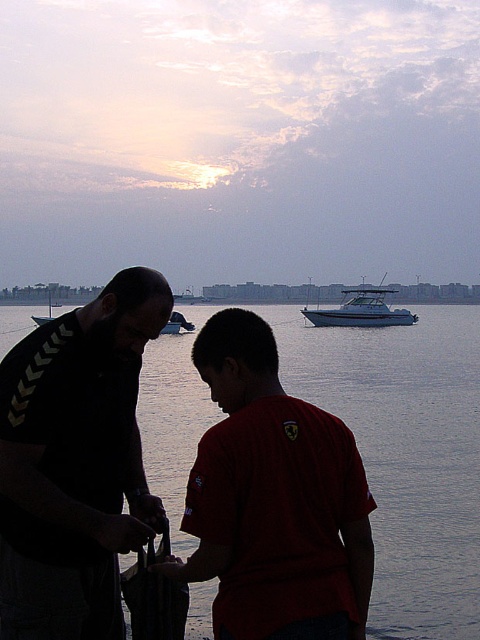
Question: Estimate the real-world distances between objects in this image. Which object is farther from the black matte shirt at center?

Choices:
 (A) metallic silver boat at center
 (B) white glossy boat at upper center
 (C) matte red shirt at center

Answer: (B)

Question: Does white glossy boat at upper center have a lesser width compared to metallic silver boat at center?

Choices:
 (A) yes
 (B) no

Answer: (B)

Question: Can you confirm if matte red shirt at center is thinner than metallic silver boat at center?

Choices:
 (A) yes
 (B) no

Answer: (A)

Question: Which point appears farthest from the camera in this image?

Choices:
 (A) (81, 621)
 (B) (175, 316)
 (C) (152, 401)
 (D) (328, 499)

Answer: (B)

Question: Which object appears closest to the camera in this image?

Choices:
 (A) white glossy boat at upper center
 (B) metallic silver boat at center
 (C) matte red shirt at center

Answer: (C)

Question: Does smooth water at center come behind white glossy boat at upper center?

Choices:
 (A) no
 (B) yes

Answer: (A)